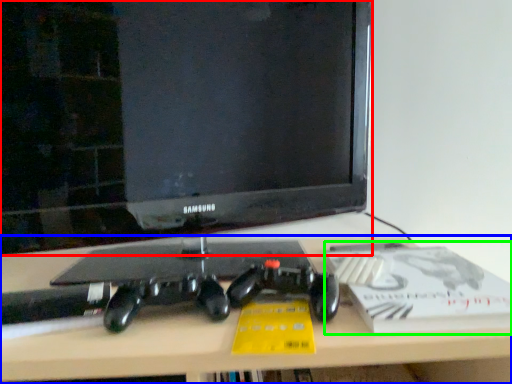
Question: Considering the real-world distances, which object is farthest from television (highlighted by a red box)? desk (highlighted by a blue box) or paperback book (highlighted by a green box)?

Choices:
 (A) desk
 (B) paperback book

Answer: (A)